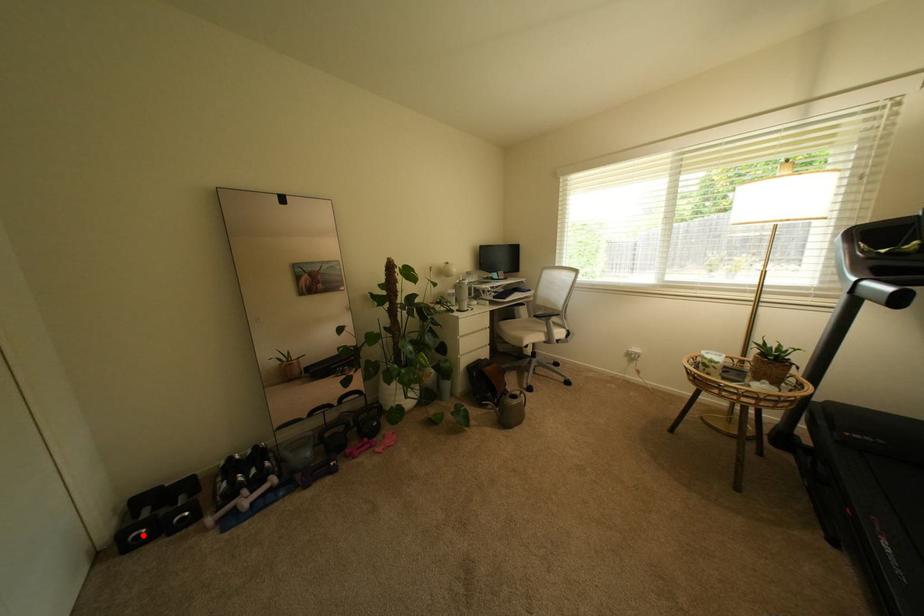
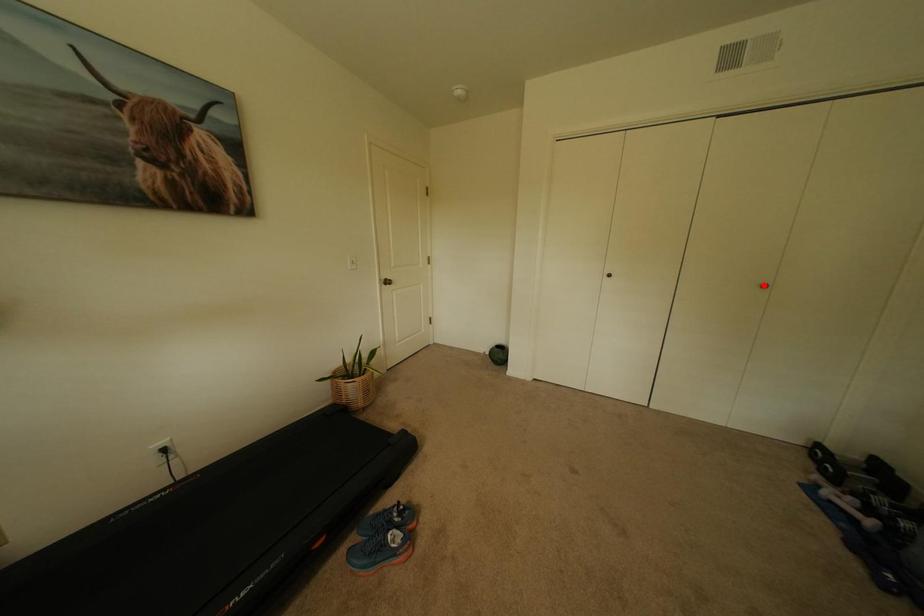
Consider the image. I am providing you with two images of the same scene from different viewpoints. A red point is marked on the first image and another point is marked on the second image. Are the points marked in image1 and image2 representing the same 3D position?

No